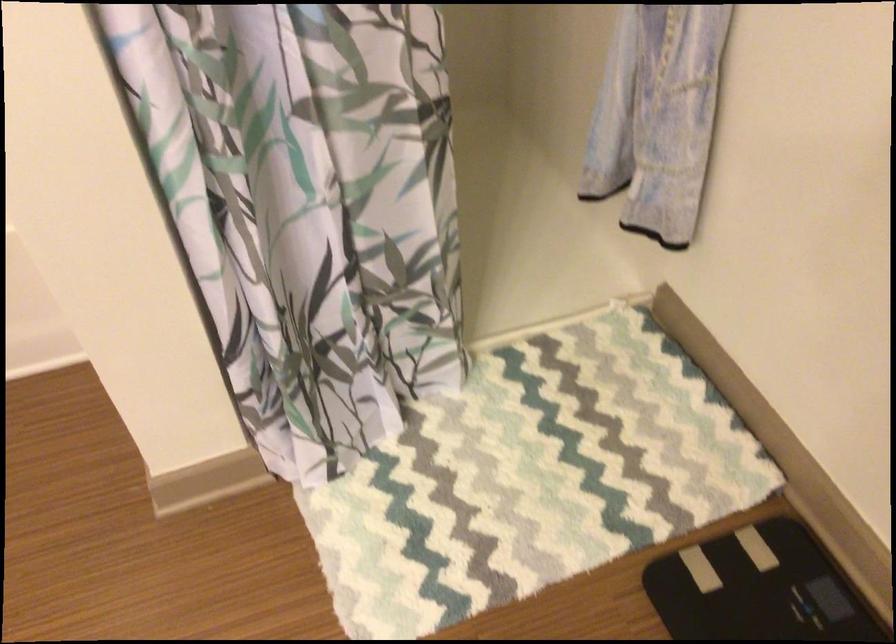
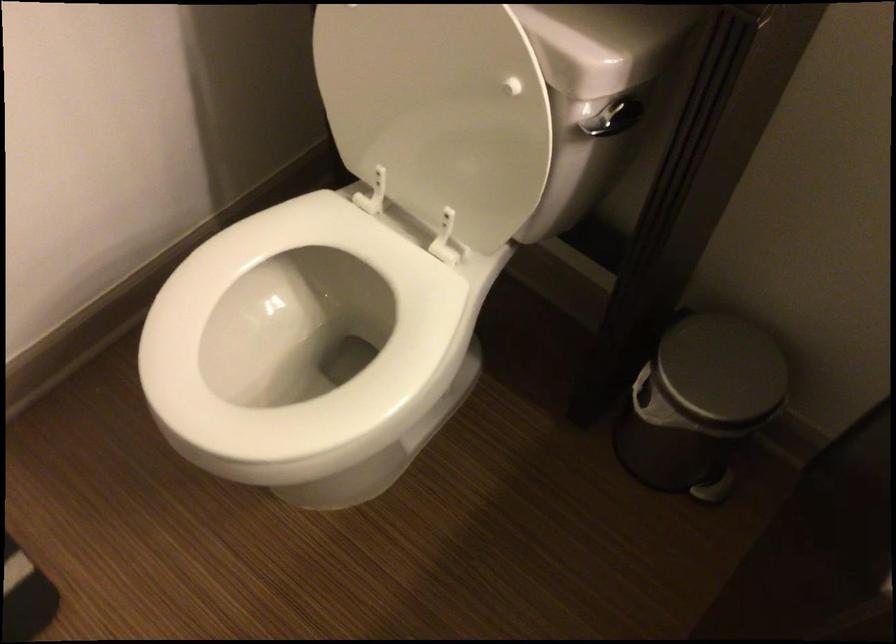
First-person continuous shooting, in which direction is the camera rotating?

The camera's rotation is toward right-down.